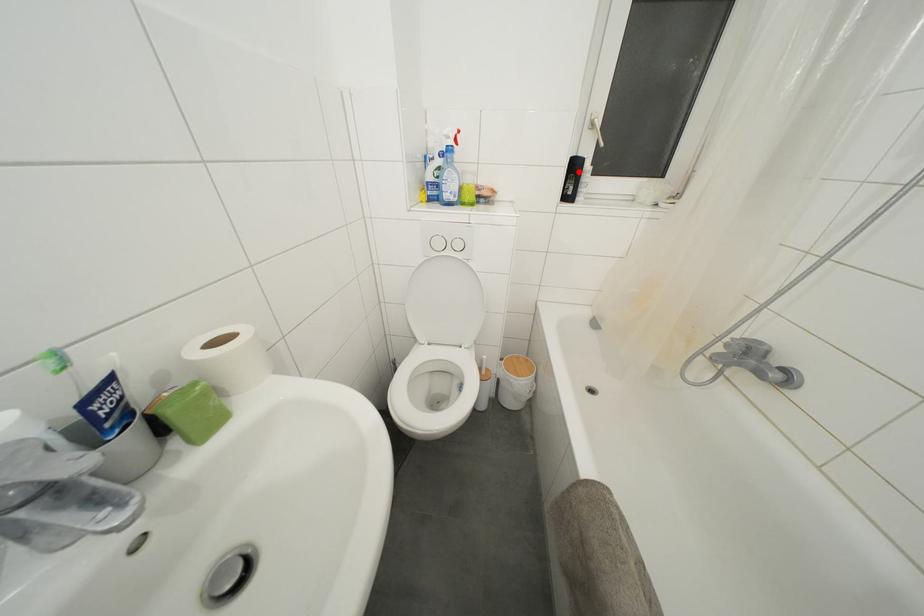
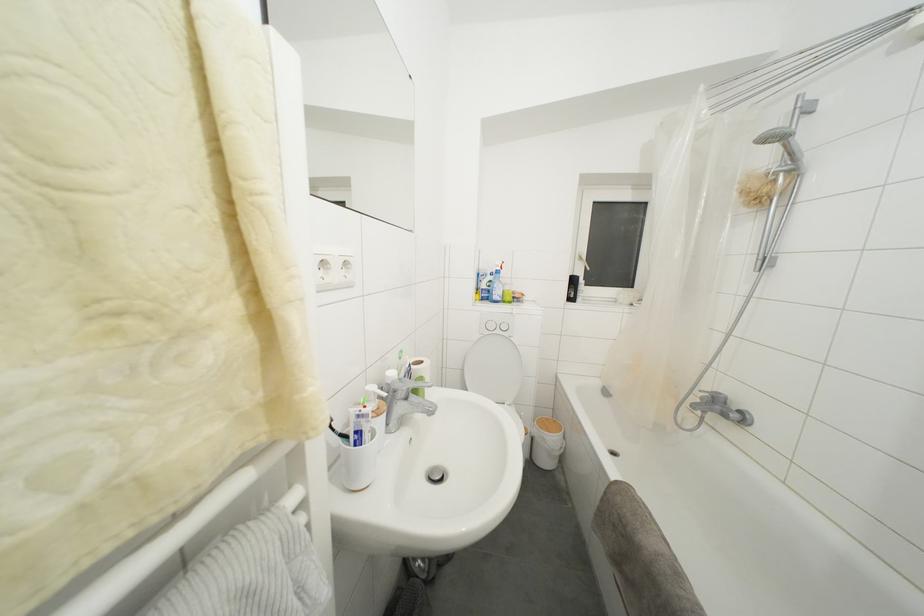
In the second image, find the point that corresponds to the highlighted location in the first image.

(578, 286)